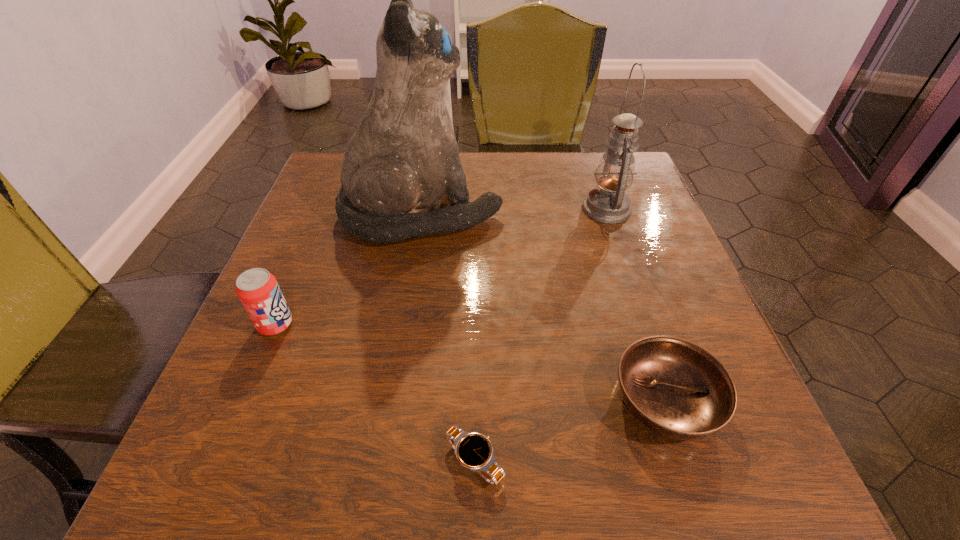
Locate an element on the screen. cat is located at coordinates (403, 157).

I want to click on the second tallest object, so click(x=608, y=203).

I want to click on the leftmost object, so point(258,290).

You are a GUI agent. You are given a task and a screenshot of the screen. Output one action in this format:
    pyautogui.click(x=<x>, y=<y>)
    Task: Click on the third tallest object
    
    Given the screenshot: What is the action you would take?
    pyautogui.click(x=258, y=290)

Locate an element on the screen. The width and height of the screenshot is (960, 540). the fourth tallest object is located at coordinates (674, 387).

In order to click on watch in this screenshot , I will do pyautogui.click(x=474, y=451).

Locate an element on the screen. free space located at the face of the tallest object is located at coordinates (606, 213).

Find the location of `blank area located on the front of the oil lamp`. blank area located on the front of the oil lamp is located at coordinates (654, 348).

Locate an element on the screen. This screenshot has height=540, width=960. vacant space located on the surface of the third nearest object is located at coordinates (497, 325).

Find the location of `vacant space situated on the left of the soup bowl`. vacant space situated on the left of the soup bowl is located at coordinates (457, 401).